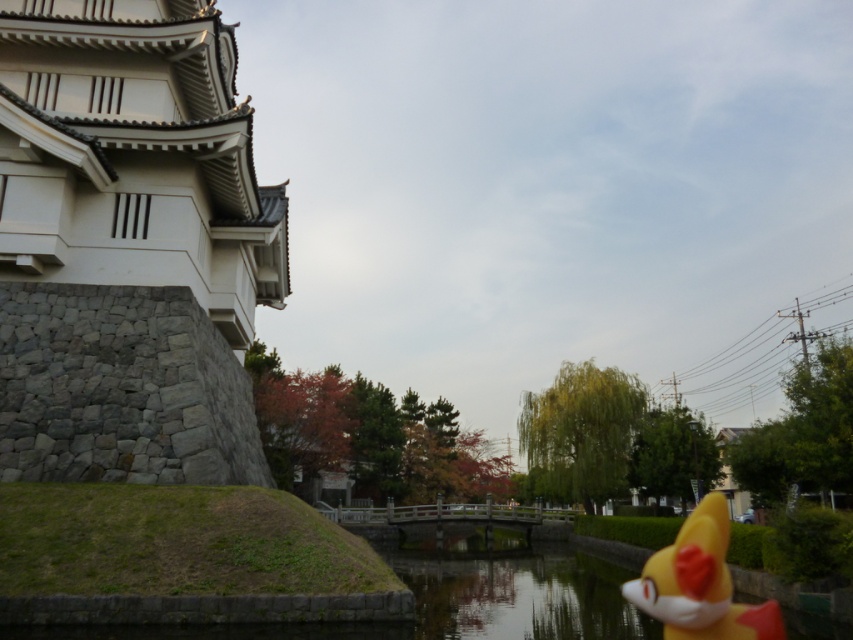
You are planning to build a small wooden fence around the white stone tower at left and the yellow rubber fox at lower right. Which object requires a wider fence to enclose it?

The yellow rubber fox at lower right requires a wider fence because its width is greater than the white stone tower at left.

You are standing at the center of the scene and want to reach the yellow rubber fox at lower right. Which direction should you move to avoid passing in front of the white stone tower at left?

To reach the yellow rubber fox at lower right without passing in front of the white stone tower at left, you should move to the right side of the scene. Since the yellow rubber fox at lower right is behind the white stone tower at left, moving to the right would allow you to bypass the tower and reach the fox directly.